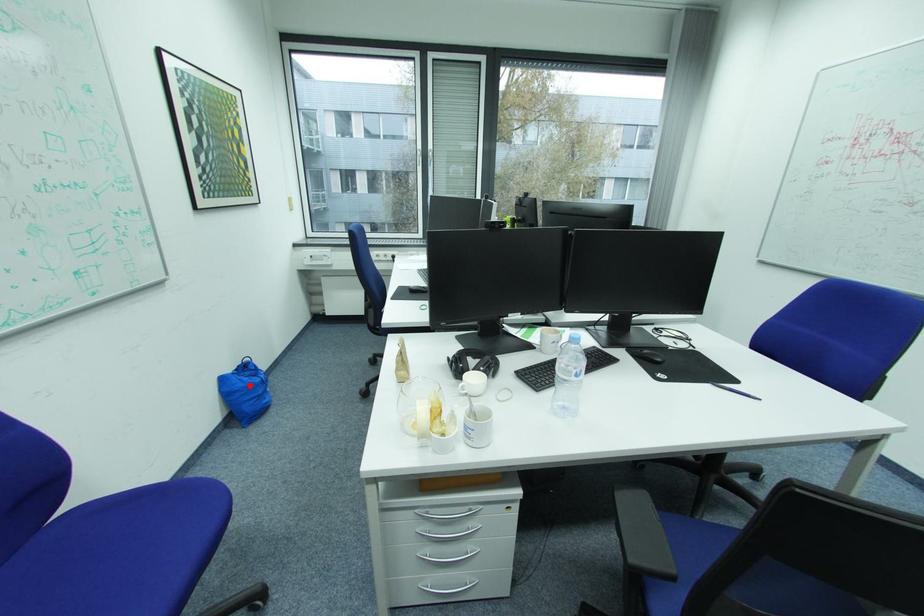
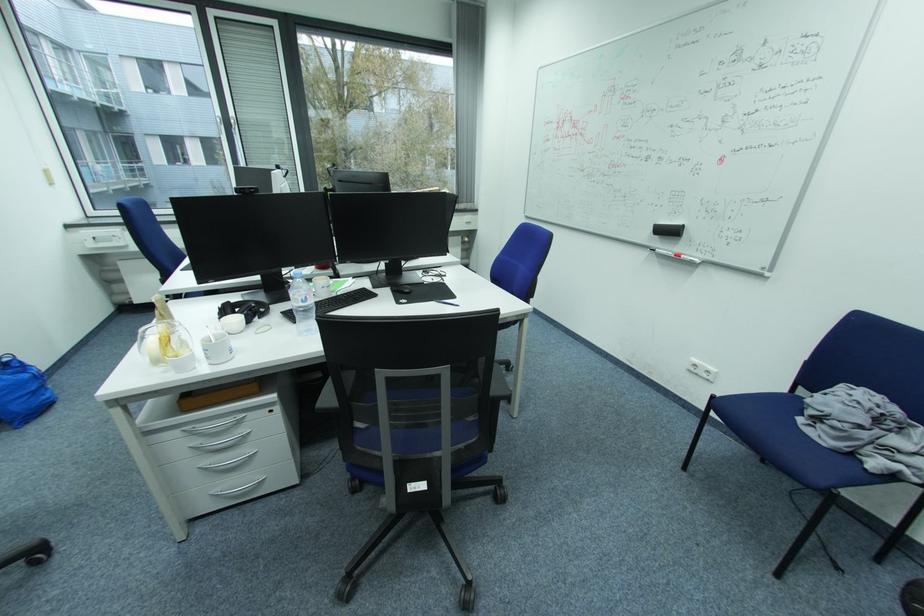
Question: A red point is marked in image1. In image2, is the corresponding 3D point closer to the camera or farther? Reply with the corresponding letter.

Choices:
 (A) The corresponding 3D point is closer.
 (B) The corresponding 3D point is farther.

Answer: (B)